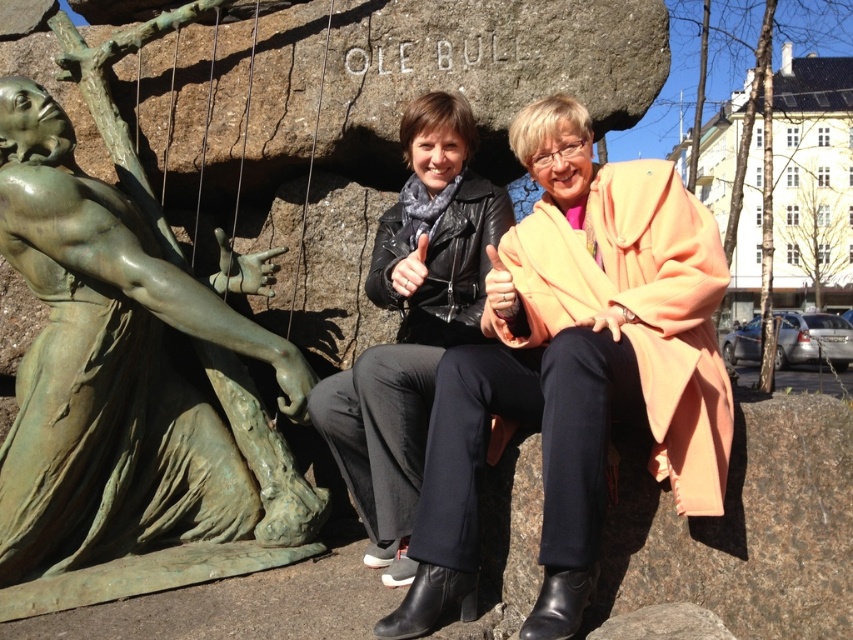
You are a photographer trying to capture the matte black leather jacket at center and the green patina bronze statue at left in a single shot. Can you position yourself so that both are fully visible without any part of the statue being blocked by the jacket?

The matte black leather jacket at center is in front of the green patina bronze statue at left, so positioning yourself to one side of the jacket would allow you to see both without obstruction. Alternatively, moving back to get a wider angle might also work, ensuring the statue isn

You are an artist planning to sketch the scene. You need to decide which object to draw first based on their sizes. According to the scene, which one should you start with, the green patina bronze statue at left or the black leather jacket at center?

The green patina bronze statue at left is larger in width than the black leather jacket at center, so you should start with the green patina bronze statue at left to ensure proper scaling in your sketch.

You are a photographer trying to capture the matte black leather jacket at center in your shot. The camera is positioned at point A, which is at coordinates 0.5, 0.5. Can you determine if the jacket is within the camera frame? Please state your answer based on the coordinates provided.

The matte black leather jacket at center is located at coordinates (575, 369), which is slightly to the right and above the camera position at (426, 320). Assuming the camera frame includes a standard field of view, the jacket should be within the frame.